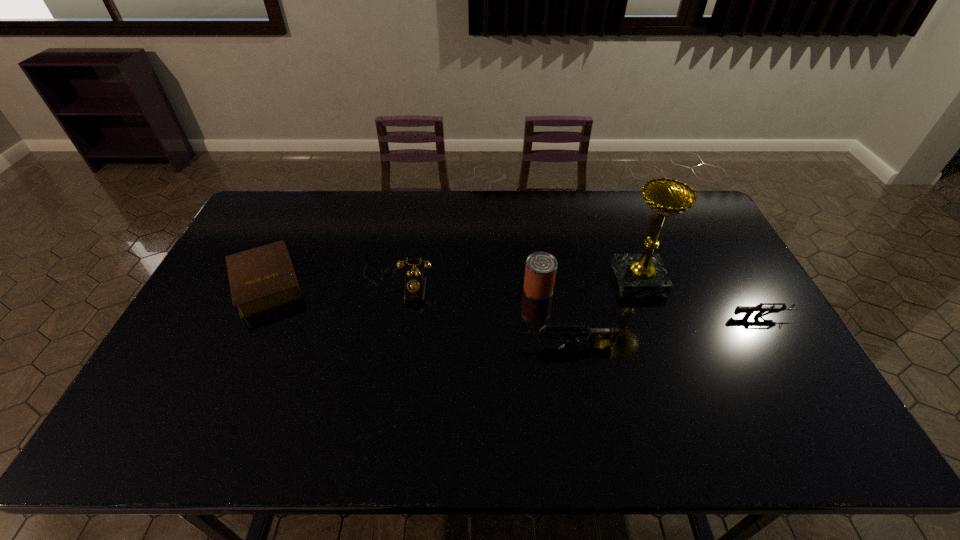
Please point a spot to add another gun on the left. Please provide its 2D coordinates. Your answer should be formatted as a tuple, i.e. [(x, y)], where the tuple contains the x and y coordinates of a point satisfying the conditions above.

[(341, 375)]